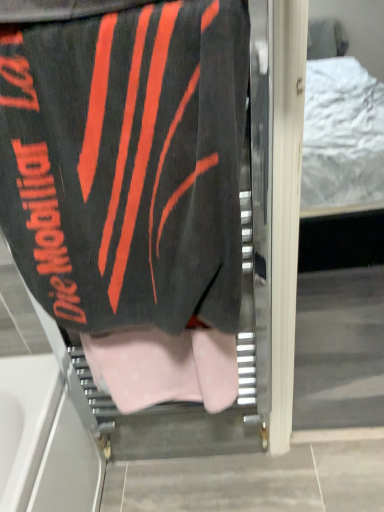
Question: Is black fabric towel at upper left spatially inside pink polka dot fabric at center, or outside of it?

Choices:
 (A) inside
 (B) outside

Answer: (B)

Question: In the image, is black fabric towel at upper left on the left side or the right side of pink polka dot fabric at center?

Choices:
 (A) right
 (B) left

Answer: (B)

Question: In terms of width, does black fabric towel at upper left look wider or thinner when compared to pink polka dot fabric at center?

Choices:
 (A) wide
 (B) thin

Answer: (A)

Question: In the image, is pink polka dot fabric at center positioned in front of or behind black fabric towel at upper left?

Choices:
 (A) behind
 (B) front

Answer: (A)

Question: Is pink polka dot fabric at center spatially inside black fabric towel at upper left, or outside of it?

Choices:
 (A) outside
 (B) inside

Answer: (A)

Question: Is pink polka dot fabric at center bigger or smaller than black fabric towel at upper left?

Choices:
 (A) small
 (B) big

Answer: (A)

Question: Is point (92, 355) closer or farther from the camera than point (109, 77)?

Choices:
 (A) closer
 (B) farther

Answer: (B)